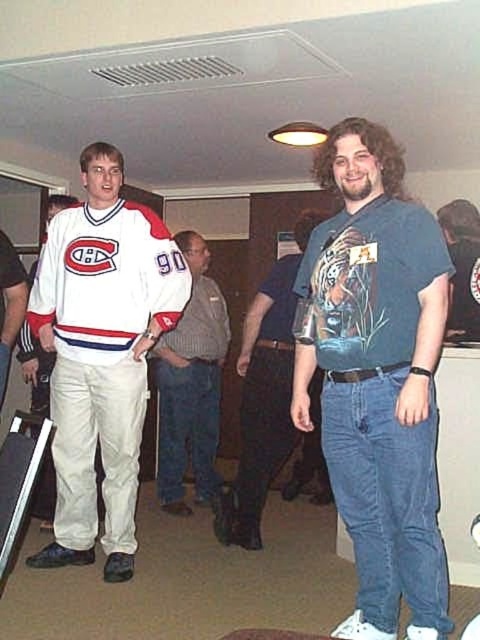
You are a photographer trying to capture a closeup of the blue denim jeans at center. Based on their position coordinates, where should you aim your camera?

The blue denim jeans at center are located at coordinates point [376,378], so you should aim your camera at that point to capture a closeup.